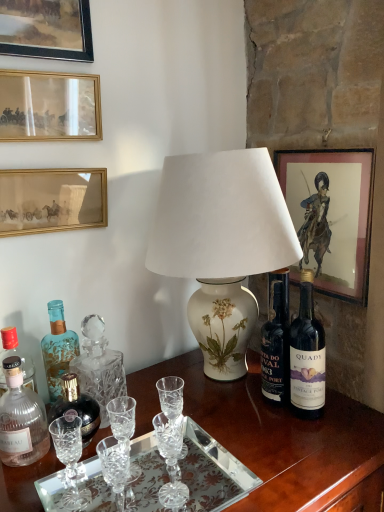
Where is `vacant space to the right of clear crystal wine glass at center`? The image size is (384, 512). vacant space to the right of clear crystal wine glass at center is located at coordinates click(249, 424).